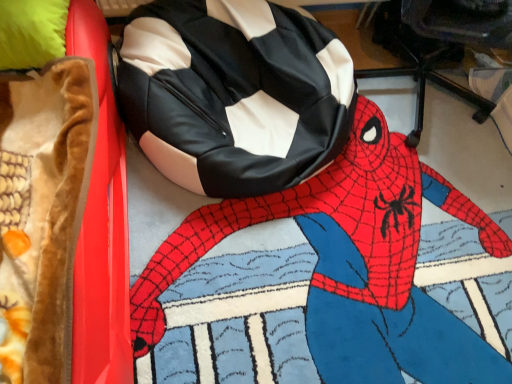
This screenshot has height=384, width=512. Describe the element at coordinates (234, 94) in the screenshot. I see `black leather bean bag chair at center` at that location.

Locate an element on the screen. This screenshot has width=512, height=384. black leather bean bag at upper center is located at coordinates (319, 281).

Is black leather bean bag chair at center placed right next to black leather bean bag at upper center?

black leather bean bag chair at center is not next to black leather bean bag at upper center, and they're not touching.

How far apart are black leather bean bag chair at center and black leather bean bag at upper center?

38.14 centimeters.

Who is smaller, black leather bean bag chair at center or black leather bean bag at upper center?

With smaller size is black leather bean bag at upper center.

From a real-world perspective, which object stands above the other?

From a 3D spatial view, black leather bean bag chair at center is above.

From a real-world perspective, is black leather bean bag chair at center physically below velvet brown blanket at left?

Correct, in the physical world, black leather bean bag chair at center is lower than velvet brown blanket at left.

Is black leather bean bag chair at center facing towards velvet brown blanket at left?

No, black leather bean bag chair at center does not turn towards velvet brown blanket at left.

From the picture: Which point is more distant from viewer, (245, 135) or (19, 218)?

The point (245, 135) is farther from the camera.

In terms of height, does black leather bean bag chair at center look taller or shorter compared to velvet brown blanket at left?

black leather bean bag chair at center is shorter than velvet brown blanket at left.

Based on the photo, is black leather bean bag at upper center positioned with its back to black leather bean bag chair at center?

No, black leather bean bag chair at center is not at the back of black leather bean bag at upper center.

Is black leather bean bag at upper center not inside black leather bean bag chair at center?

black leather bean bag at upper center lies outside black leather bean bag chair at center's area.

Between black leather bean bag at upper center and black leather bean bag chair at center, which one has larger width?

With larger width is black leather bean bag at upper center.

Consider the image. Measure the distance from black leather bean bag at upper center to black leather bean bag chair at center.

They are 15.02 inches apart.

Considering the positions of points (68, 93) and (208, 42), is point (68, 93) closer to camera compared to point (208, 42)?

Yes, it is in front of point (208, 42).

Is velvet brown blanket at left to the left of black leather bean bag chair at center from the viewer's perspective?

Correct, you'll find velvet brown blanket at left to the left of black leather bean bag chair at center.

Between velvet brown blanket at left and black leather bean bag chair at center, which one has more height?

Standing taller between the two is velvet brown blanket at left.

Considering the positions of objects black leather bean bag at upper center and velvet brown blanket at left in the image provided, who is behind, black leather bean bag at upper center or velvet brown blanket at left?

black leather bean bag at upper center is further from the camera.

Is black leather bean bag at upper center completely or partially outside of velvet brown blanket at left?

black leather bean bag at upper center is positioned outside velvet brown blanket at left.

Based on the photo, from a real-world perspective, is black leather bean bag at upper center located beneath velvet brown blanket at left?

Yes, from a real-world perspective, black leather bean bag at upper center is beneath velvet brown blanket at left.

Which object is wider, black leather bean bag at upper center or velvet brown blanket at left?

velvet brown blanket at left is wider.

Is velvet brown blanket at left looking in the opposite direction of black leather bean bag at upper center?

No.

Identify the location of blanket above the black leather bean bag at upper center (from the image's perspective). (42, 214).

Consider the image. From a real-world perspective, is velvet brown blanket at left above or below black leather bean bag at upper center?

Clearly, from a real-world perspective, velvet brown blanket at left is above black leather bean bag at upper center.

Does point (45, 260) come closer to viewer compared to point (346, 244)?

That is True.

Locate an element on the screen. The width and height of the screenshot is (512, 384). person in front of the black leather bean bag chair at center is located at coordinates (319, 281).

At what (x,y) coordinates should I click in order to perform the action: click on bean bag chair below the velvet brown blanket at left (from a real-world perspective). Please return your answer as a coordinate pair (x, y). The height and width of the screenshot is (384, 512). Looking at the image, I should click on (234, 94).

Estimate the real-world distances between objects in this image. Which object is closer to black leather bean bag chair at center, velvet brown blanket at left or black leather bean bag at upper center?

black leather bean bag at upper center is positioned closer to the anchor black leather bean bag chair at center.

Which object lies nearer to the anchor point black leather bean bag at upper center, velvet brown blanket at left or black leather bean bag chair at center?

black leather bean bag chair at center lies closer to black leather bean bag at upper center than the other object.

Which object lies further to the anchor point black leather bean bag at upper center, black leather bean bag chair at center or velvet brown blanket at left?

velvet brown blanket at left is positioned further to the anchor black leather bean bag at upper center.

Looking at the image, which one is located further to velvet brown blanket at left, black leather bean bag chair at center or black leather bean bag at upper center?

Based on the image, black leather bean bag at upper center appears to be further to velvet brown blanket at left.

Which object lies further to the anchor point velvet brown blanket at left, black leather bean bag at upper center or black leather bean bag chair at center?

black leather bean bag at upper center.

Looking at the image, which one is located further to black leather bean bag chair at center, black leather bean bag at upper center or velvet brown blanket at left?

velvet brown blanket at left.

Find the location of `bean bag chair situated between velvet brown blanket at left and black leather bean bag at upper center from left to right`. bean bag chair situated between velvet brown blanket at left and black leather bean bag at upper center from left to right is located at coordinates (234, 94).